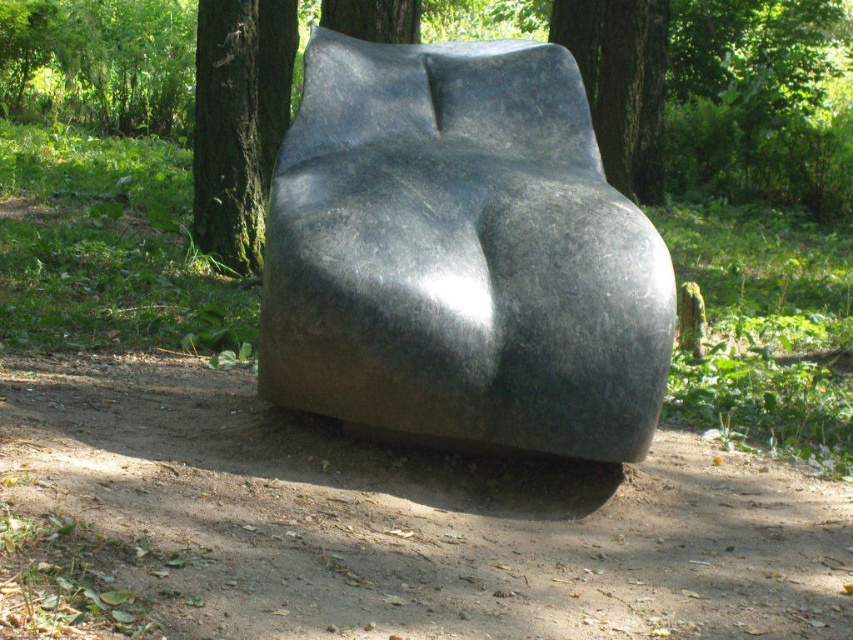
Question: Does glossy black sculpture at center appear on the left side of smooth bark tree at upper center?

Choices:
 (A) yes
 (B) no

Answer: (A)

Question: Estimate the real-world distances between objects in this image. Which object is closer to the glossy black sculpture at center?

Choices:
 (A) green mossy bark tree at center
 (B) smooth bark tree at upper center

Answer: (A)

Question: Is glossy black sculpture at center to the left of smooth bark tree at upper center from the viewer's perspective?

Choices:
 (A) no
 (B) yes

Answer: (B)

Question: Which of the following is the farthest from the observer?

Choices:
 (A) (592, 26)
 (B) (231, 266)
 (C) (589, 364)

Answer: (A)

Question: Does green mossy bark tree at center have a smaller size compared to smooth bark tree at upper center?

Choices:
 (A) yes
 (B) no

Answer: (B)

Question: Among these objects, which one is farthest from the camera?

Choices:
 (A) glossy black sculpture at center
 (B) smooth bark tree at upper center
 (C) green mossy bark tree at center

Answer: (B)